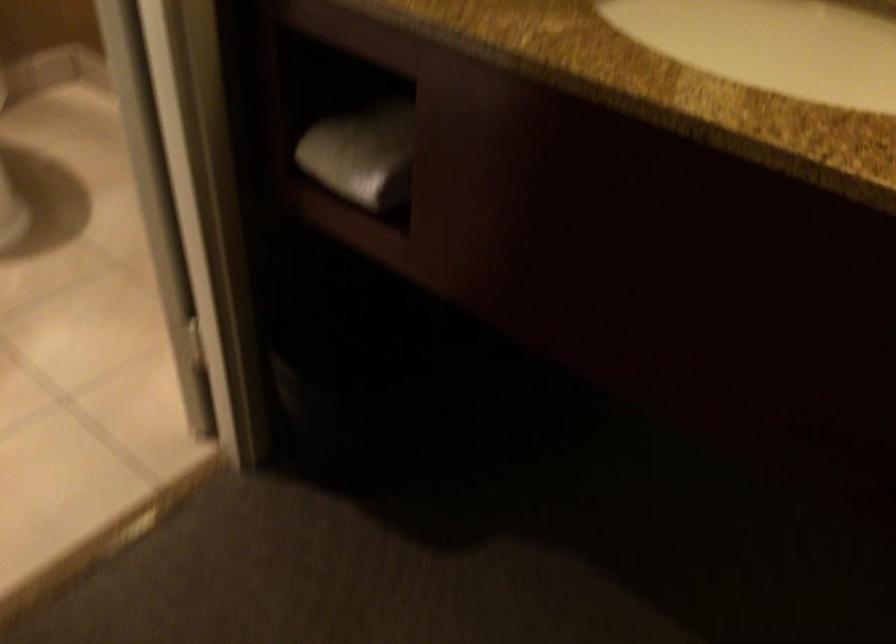
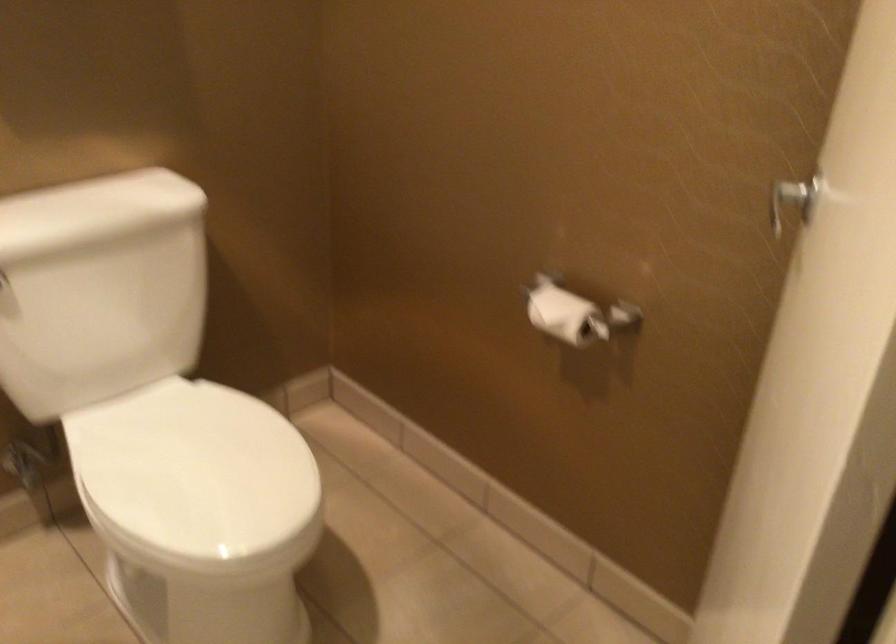
Question: The first image is from the beginning of the video and the second image is from the end. How did the camera likely rotate when shooting the video?

Choices:
 (A) Left
 (B) Right
 (C) Up
 (D) Down

Answer: (C)